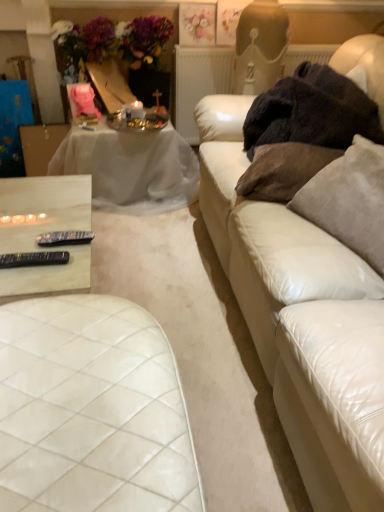
Locate an element on the screen. free location in front of black plastic remote control at lower left, the 2th tableware from the front is located at coordinates (44, 283).